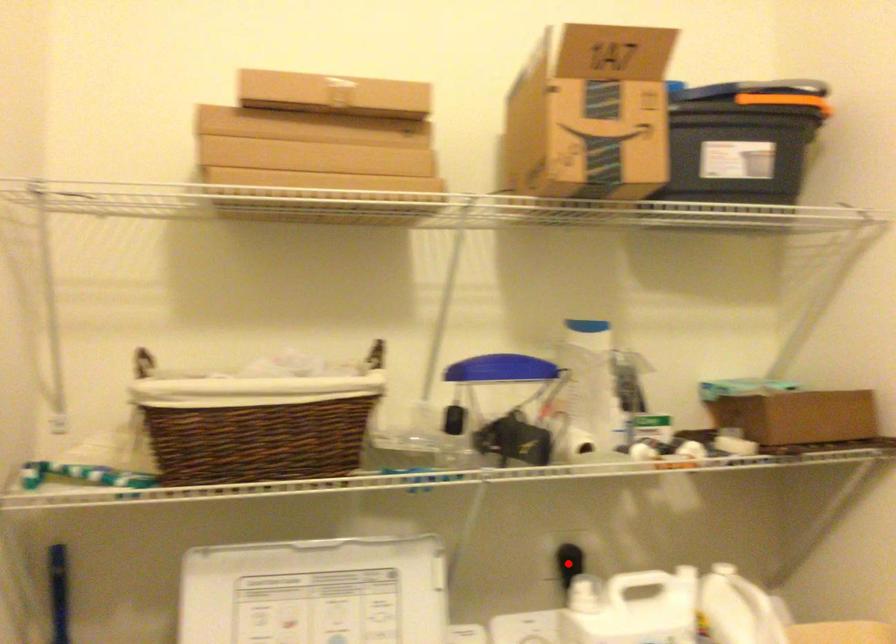
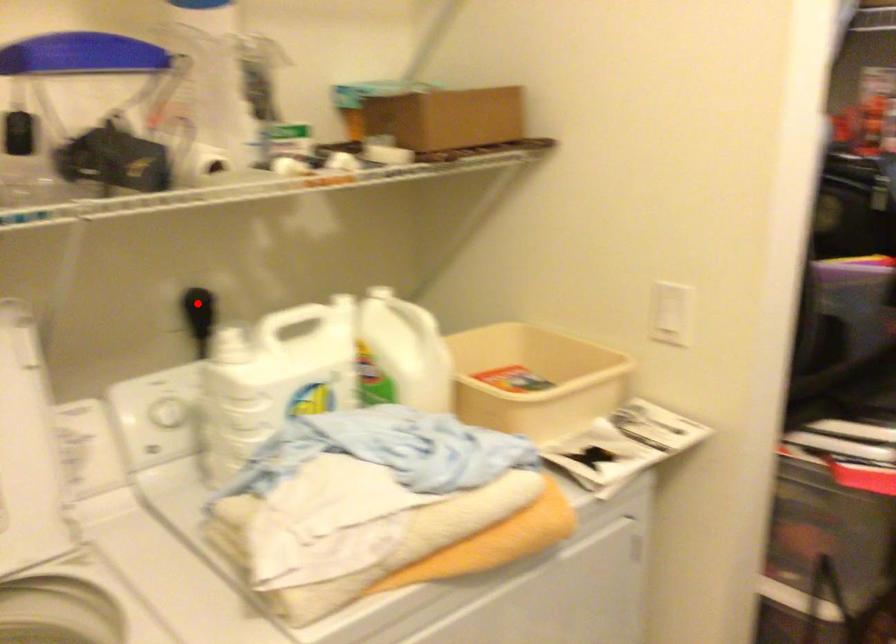
I am providing you with two images of the same scene from different viewpoints. A red point is marked on the first image and another point is marked on the second image. Is the red point in image1 aligned with the point shown in image2?

Yes